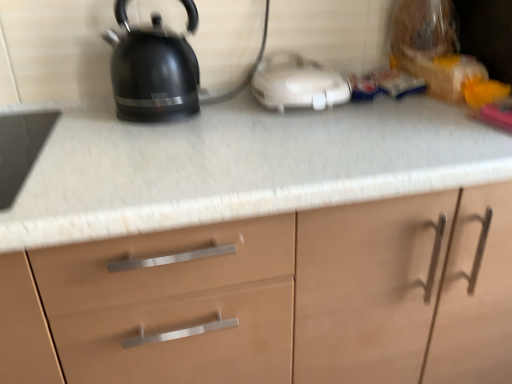
Identify the location of free space to the right of white plastic toaster at center. The image size is (512, 384). (403, 111).